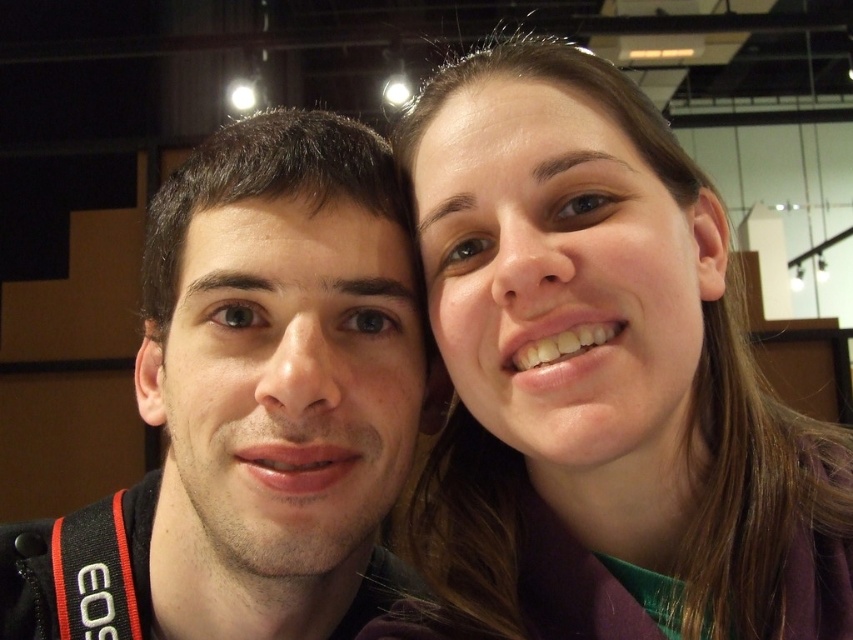
You are a photographer setting up for a portrait session. You notice the smooth brown hair at upper right and the matte black jacket at left in the frame. Which object is located higher in the image?

The smooth brown hair at upper right is positioned over the matte black jacket at left, so it is higher in the image.

You are taking a photo of two people in a modern room with exposed beams. You notice the smooth brown hair at upper right and the matte black jacket at left. Which object is positioned to the right side of the other?

The smooth brown hair at upper right is to the right of the matte black jacket at left according to the description.